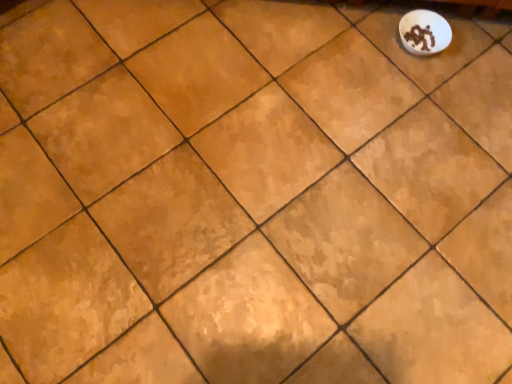
At what (x,y) coordinates should I click in order to perform the action: click on free space to the back side of white glossy bowl at upper right. Please return your answer as a coordinate pair (x, y). The width and height of the screenshot is (512, 384). Looking at the image, I should click on (420, 11).